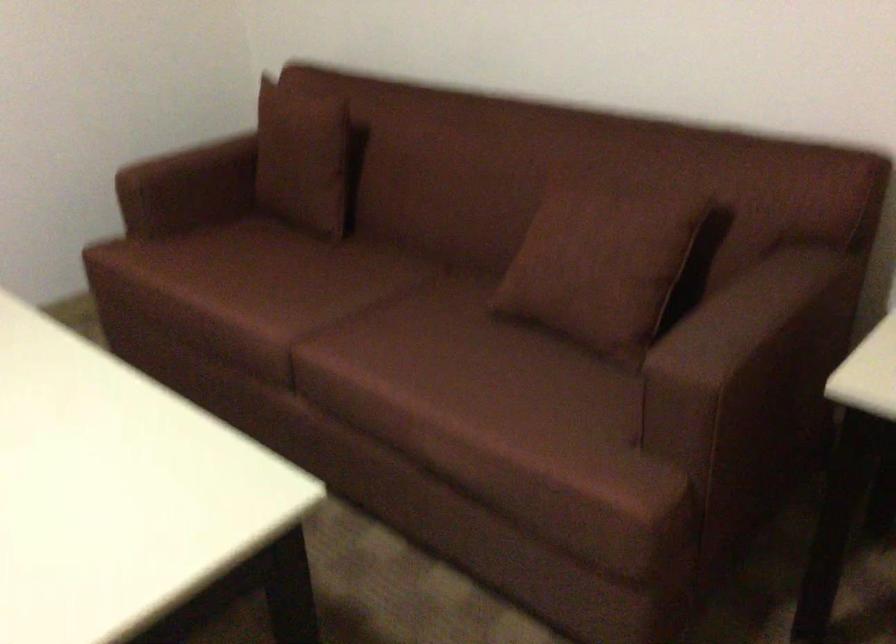
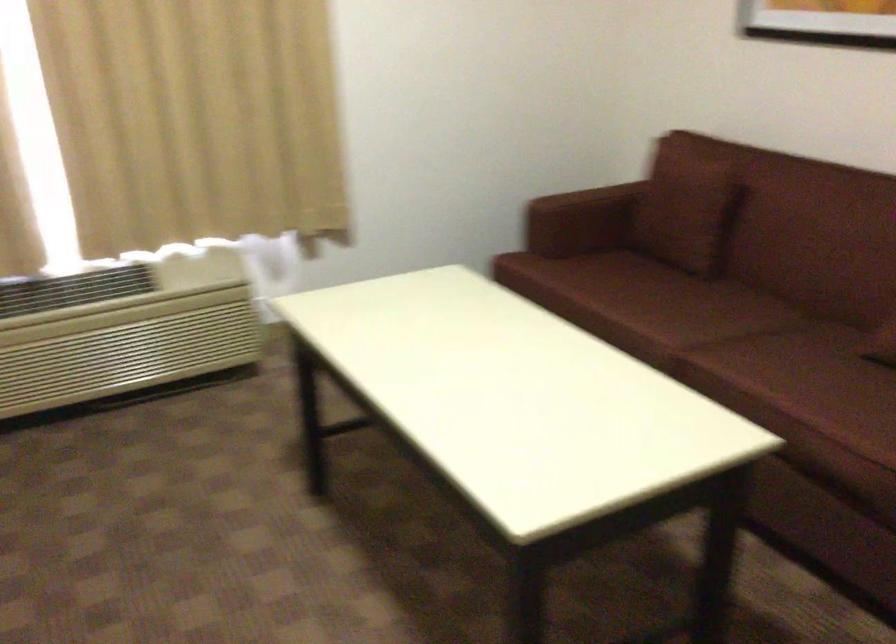
In the second image, find the point that corresponds to (309,292) in the first image.

(682, 310)